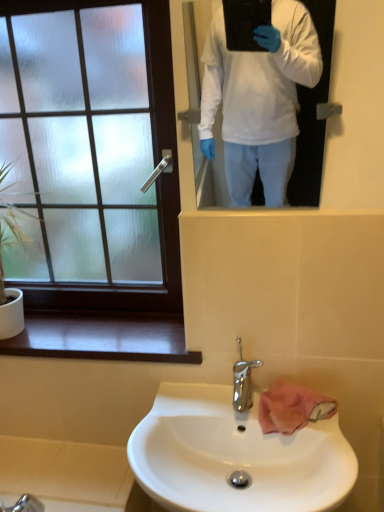
The image size is (384, 512). Identify the location of vacant region to the left of chrome metallic faucet at center. (194, 412).